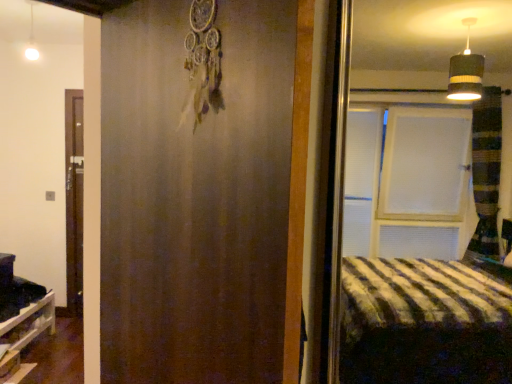
Question: Is white glossy light fixture at upper left further to the viewer compared to matte brown barn door at center?

Choices:
 (A) yes
 (B) no

Answer: (A)

Question: Would you say matte brown barn door at center is part of white glossy light fixture at upper left's contents?

Choices:
 (A) no
 (B) yes

Answer: (A)

Question: Is white glossy light fixture at upper left not within matte brown barn door at center?

Choices:
 (A) yes
 (B) no

Answer: (A)

Question: From a real-world perspective, is white glossy light fixture at upper left below matte brown barn door at center?

Choices:
 (A) yes
 (B) no

Answer: (B)

Question: Is white glossy light fixture at upper left not near matte brown barn door at center?

Choices:
 (A) yes
 (B) no

Answer: (A)

Question: From the image's perspective, would you say white glossy light fixture at upper left is positioned over matte brown barn door at center?

Choices:
 (A) no
 (B) yes

Answer: (B)

Question: Considering the relative sizes of white glossy light fixture at upper left and white wooden shelf at lower left in the image provided, is white glossy light fixture at upper left shorter than white wooden shelf at lower left?

Choices:
 (A) yes
 (B) no

Answer: (A)

Question: Considering the relative positions of white glossy light fixture at upper left and white wooden shelf at lower left in the image provided, is white glossy light fixture at upper left in front of white wooden shelf at lower left?

Choices:
 (A) yes
 (B) no

Answer: (A)

Question: Is white glossy light fixture at upper left not inside white wooden shelf at lower left?

Choices:
 (A) yes
 (B) no

Answer: (A)

Question: Can you confirm if white glossy light fixture at upper left is taller than white wooden shelf at lower left?

Choices:
 (A) no
 (B) yes

Answer: (A)

Question: From the image's perspective, is white glossy light fixture at upper left located beneath white wooden shelf at lower left?

Choices:
 (A) no
 (B) yes

Answer: (A)

Question: Is white glossy light fixture at upper left touching white wooden shelf at lower left?

Choices:
 (A) yes
 (B) no

Answer: (B)

Question: From a real-world perspective, does matte brown barn door at center sit lower than white wooden shelf at lower left?

Choices:
 (A) yes
 (B) no

Answer: (B)